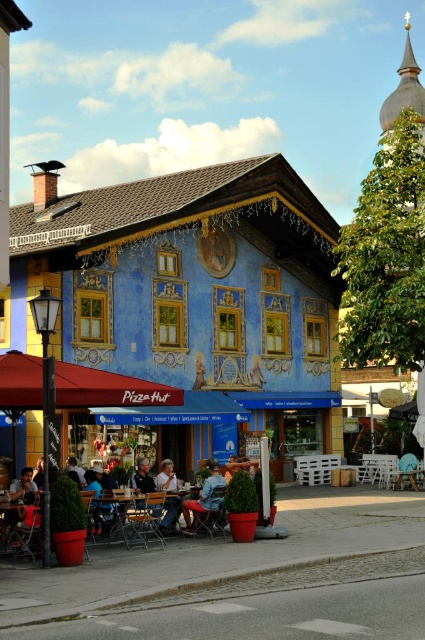
Question: Does blue painted building at center have a lesser width compared to red fabric umbrella at lower left?

Choices:
 (A) no
 (B) yes

Answer: (A)

Question: Is red fabric umbrella at lower left below light brown leather jacket at lower center?

Choices:
 (A) yes
 (B) no

Answer: (B)

Question: Which point is closer to the camera?

Choices:
 (A) (166, 525)
 (B) (28, 404)
 (C) (212, 168)

Answer: (B)

Question: Does blue painted building at center have a greater width compared to denim jacket at lower center?

Choices:
 (A) no
 (B) yes

Answer: (B)

Question: Which point appears closest to the camera in this image?

Choices:
 (A) click(x=215, y=497)
 (B) click(x=173, y=488)
 (C) click(x=22, y=360)
 (D) click(x=255, y=422)

Answer: (C)

Question: Which point is closer to the camera?

Choices:
 (A) denim jacket at lower center
 (B) light brown leather jacket at lower center

Answer: (A)